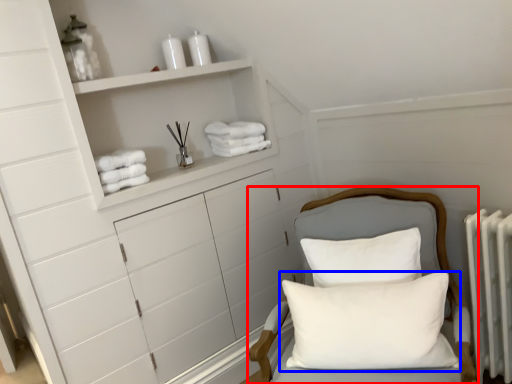
Question: Which of the following is the farthest to the observer, furniture (highlighted by a red box) or pillow (highlighted by a blue box)?

Choices:
 (A) furniture
 (B) pillow

Answer: (B)